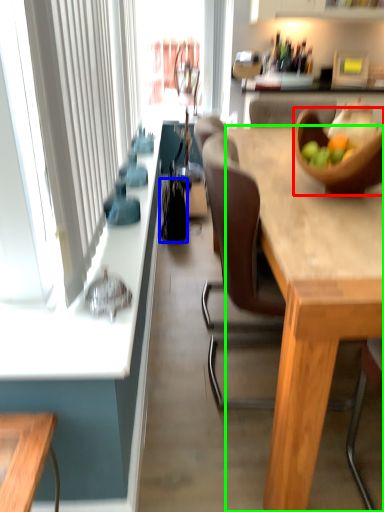
Question: Considering the real-world distances, which object is closest to bowl (highlighted by a red box)? handbag (highlighted by a blue box) or desk (highlighted by a green box).

Choices:
 (A) handbag
 (B) desk

Answer: (B)